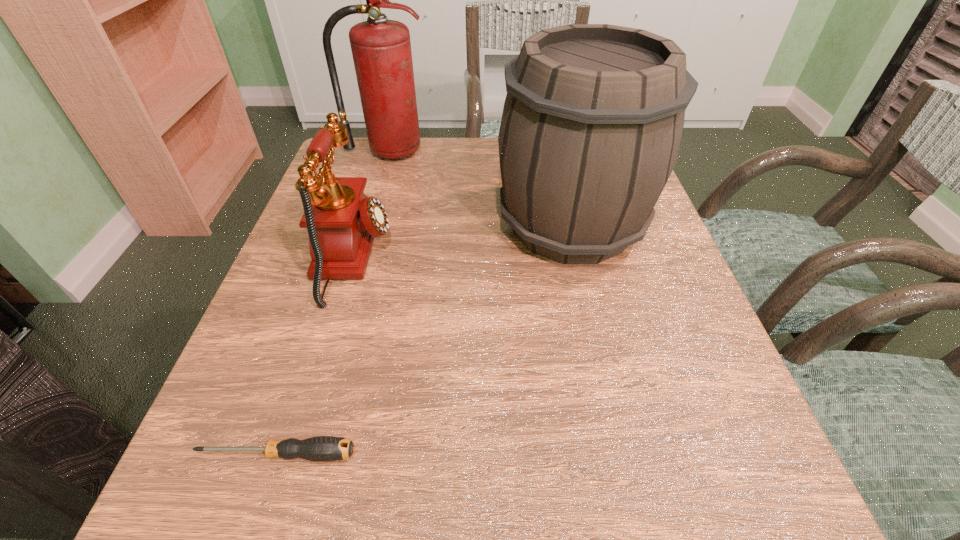
Locate an element on the screen. fire extinguisher is located at coordinates coord(381,48).

Where is `wine bucket`? Image resolution: width=960 pixels, height=540 pixels. wine bucket is located at coordinates (592, 122).

The image size is (960, 540). I want to click on telephone, so click(342, 221).

This screenshot has width=960, height=540. Identify the location of screwdriver. (321, 448).

What are the coordinates of `the nearest object` in the screenshot? It's located at (321, 448).

Where is `free region located 0.100m at the front of the fire extinguisher where the nozzle is aimed`? free region located 0.100m at the front of the fire extinguisher where the nozzle is aimed is located at coordinates (377, 186).

Where is `vacant region located on the left of the wine bucket`? This screenshot has width=960, height=540. vacant region located on the left of the wine bucket is located at coordinates (473, 225).

This screenshot has height=540, width=960. What are the coordinates of `vacant point located on the dial of the third tallest object` in the screenshot? It's located at (488, 258).

Locate an element on the screen. vacant space located on the right of the nearest object is located at coordinates (617, 454).

Locate an element on the screen. The width and height of the screenshot is (960, 540). fire extinguisher that is positioned at the far edge is located at coordinates (381, 48).